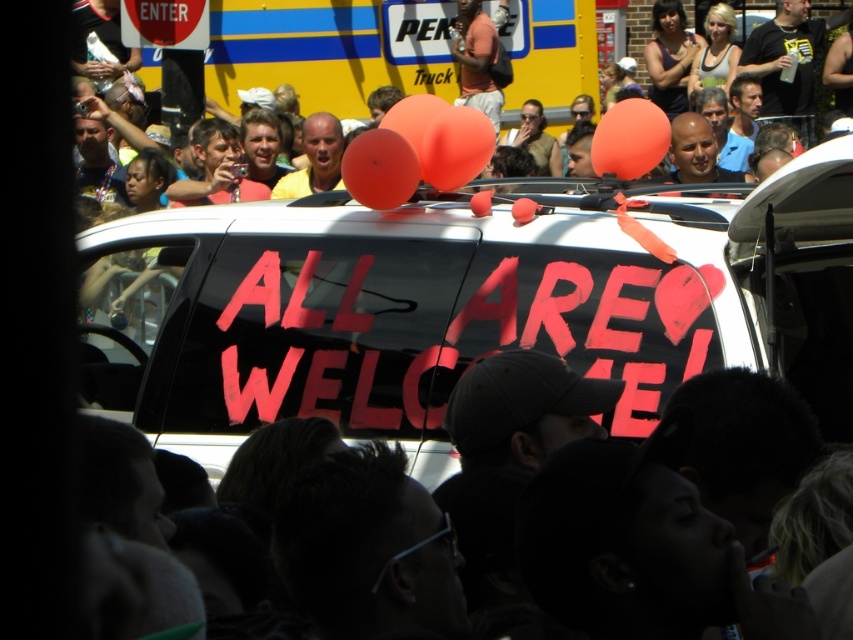
You are a photographer trying to capture both the matte black car at upper center and the orange matte balloon at center in a single frame. Based on their sizes, do you think you can fit both in your camera viewfinder without zooming in?

The matte black car at upper center might be wider than orange matte balloon at center, so it is possible to fit both in the camera viewfinder without zooming in, as the car is likely wider and the balloon is smaller.

You are a photographer at the event and want to capture the matte black car at upper center in your shot. According to the coordinates provided, where should you position your camera to ensure it is centered in the frame?

The matte black car at upper center is located at point coordinates of 0.075 on the x axis and 0.388 on the y axis. To center it in the frame, position your camera so that the crosshairs align with these coordinates.